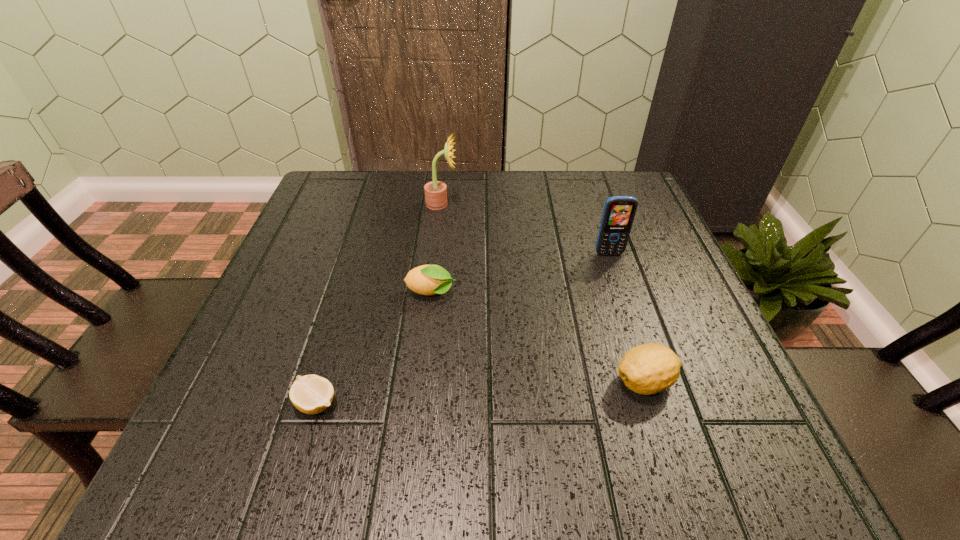
I want to click on free space located on the screen of the cellular telephone, so click(616, 275).

The height and width of the screenshot is (540, 960). I want to click on vacant region located 0.230m at the stem end of the rightmost lemon, so click(x=477, y=382).

Identify the location of free space located at the stem end of the rightmost lemon. (401, 382).

Where is `free space located at the stem end of the rightmost lemon`? This screenshot has width=960, height=540. free space located at the stem end of the rightmost lemon is located at coordinates (384, 382).

Locate an element on the screen. vacant space located 0.130m with leaves positioned above the third nearest object is located at coordinates (519, 293).

You are a GUI agent. You are given a task and a screenshot of the screen. Output one action in this format:
    pyautogui.click(x=<x>, y=<y>)
    Task: Click on the free space located 0.090m on the left of the shortest lemon
    This screenshot has width=960, height=540.
    Given the screenshot: What is the action you would take?
    pyautogui.click(x=239, y=403)

Where is `object positioned at the far edge`? The height and width of the screenshot is (540, 960). object positioned at the far edge is located at coordinates (436, 191).

Locate an element on the screen. Image resolution: width=960 pixels, height=540 pixels. object present at the left edge is located at coordinates (311, 394).

The image size is (960, 540). Find the location of `cellular telephone situated at the right edge`. cellular telephone situated at the right edge is located at coordinates (619, 212).

The width and height of the screenshot is (960, 540). What are the coordinates of `lemon that is positioned at the right edge` in the screenshot? It's located at (647, 369).